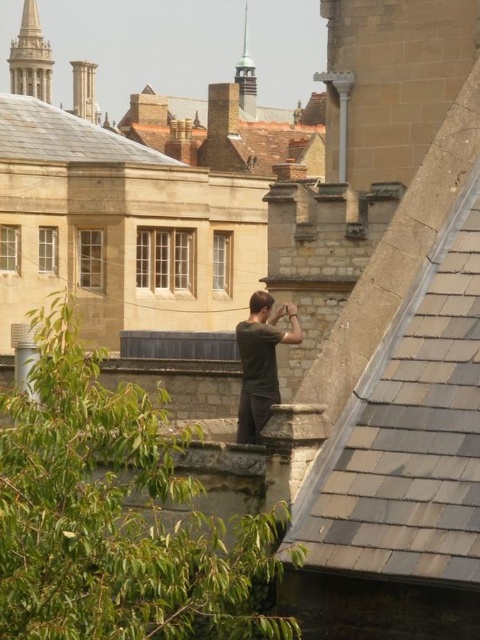
Question: Is the position of gray slate roof at upper right more distant than that of polished stone spire at upper left?

Choices:
 (A) no
 (B) yes

Answer: (A)

Question: Which point appears farthest from the camera in this image?

Choices:
 (A) (244, 83)
 (B) (254, 346)
 (C) (370, 508)
 (D) (26, 77)

Answer: (D)

Question: Which object is the farthest from the polished stone spire at upper left?

Choices:
 (A) gray slate roof at upper right
 (B) green patina spire at upper center

Answer: (A)

Question: Is brown tiled roof at upper left thinner than green patina spire at upper center?

Choices:
 (A) no
 (B) yes

Answer: (A)

Question: Which is nearer to the green patina spire at upper center?

Choices:
 (A) dark gray shirt at center
 (B) brown tiled roof at upper left

Answer: (B)

Question: Is polished stone spire at upper left closer to the viewer compared to green patina spire at upper center?

Choices:
 (A) no
 (B) yes

Answer: (A)